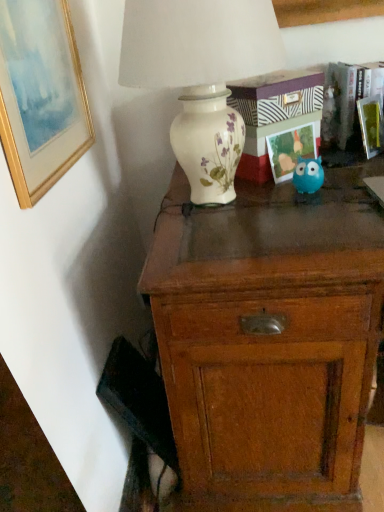
I want to click on vacant space that is in between white ceramic vase at upper center and blue rubber toy at center, so click(303, 199).